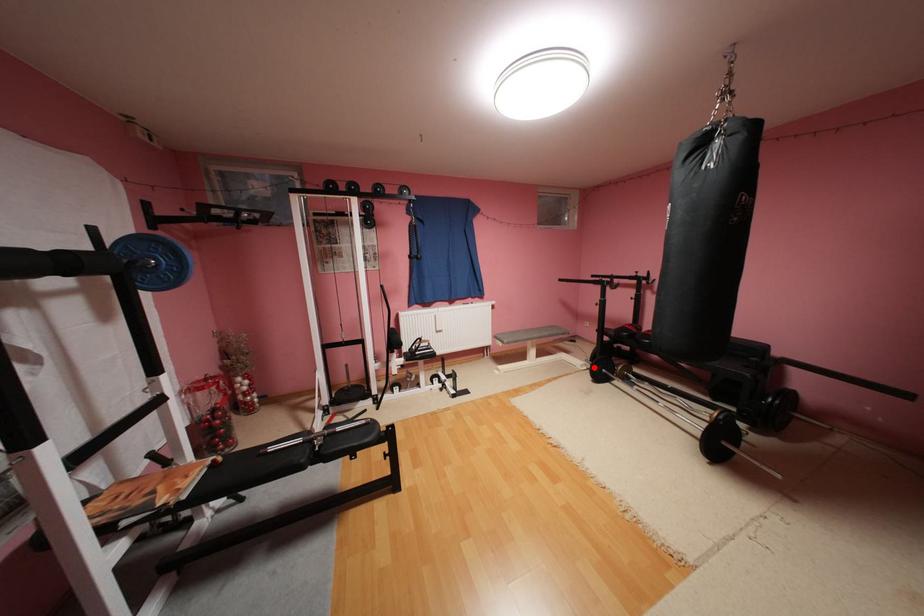
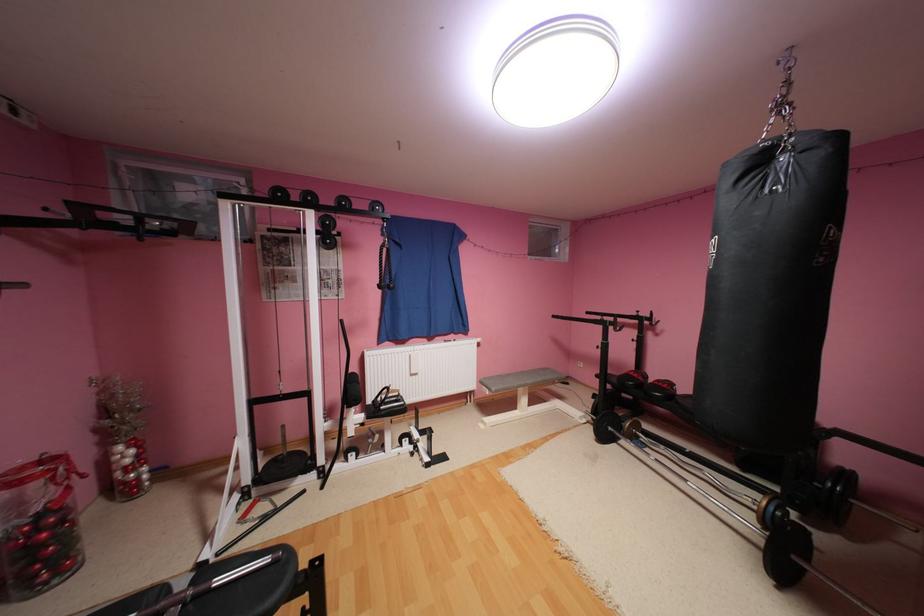
Question: I am providing you with two images of the same scene from different viewpoints. Given a red point in image1, look at the same physical point in image2. Is it:

Choices:
 (A) Closer to the viewpoint
 (B) Farther from the viewpoint

Answer: (B)